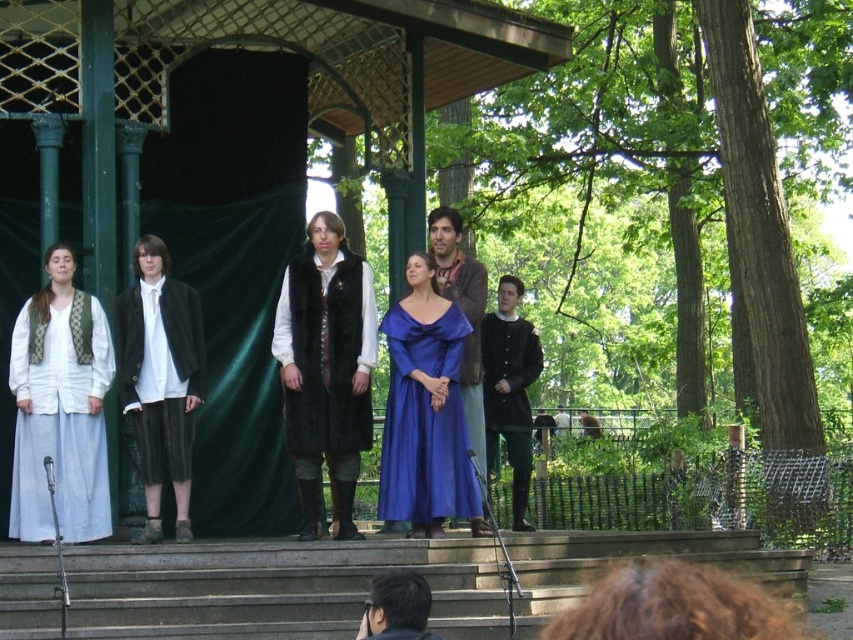
Question: Which object is the closest to the blue satin dress at center?

Choices:
 (A) concrete stairs at lower center
 (B) white woven fabric dress at left

Answer: (A)

Question: Which point is farther to the camera?

Choices:
 (A) blue satin dress at center
 (B) smooth black hair at lower center

Answer: (A)

Question: Does concrete stairs at lower center lie in front of dark green woolen tunic at center?

Choices:
 (A) yes
 (B) no

Answer: (A)

Question: Is white woven fabric dress at left wider than velvet black vest at center?

Choices:
 (A) no
 (B) yes

Answer: (B)

Question: Which object is positioned farthest from the velvet black vest at center?

Choices:
 (A) dark green woolen tunic at center
 (B) matte black coat at center
 (C) concrete stairs at lower center
 (D) velvet brown coat at center

Answer: (C)

Question: Does white woven fabric dress at left have a greater width compared to velvet black vest at center?

Choices:
 (A) yes
 (B) no

Answer: (A)